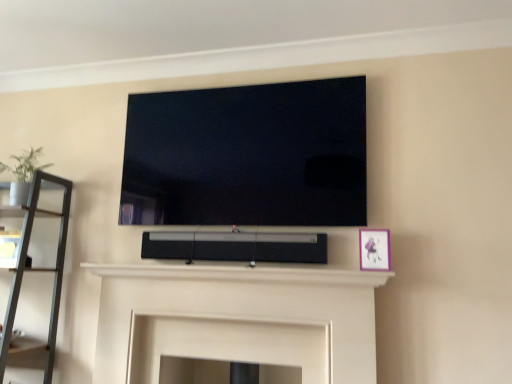
Question: Visually, is black matte speaker at center positioned to the left or to the right of green matte plant at left?

Choices:
 (A) left
 (B) right

Answer: (B)

Question: From their relative heights in the image, would you say black matte speaker at center is taller or shorter than green matte plant at left?

Choices:
 (A) short
 (B) tall

Answer: (A)

Question: Which object is positioned closest to the matte black shelf at left?

Choices:
 (A) flat screen tv at upper center
 (B) white matte fireplace at center
 (C) black matte speaker at center
 (D) green matte plant at left
 (E) matte pink picture frame at right

Answer: (D)

Question: Which of these objects is positioned closest to the black matte speaker at center?

Choices:
 (A) flat screen tv at upper center
 (B) white matte fireplace at center
 (C) matte pink picture frame at right
 (D) green matte plant at left
 (E) matte black shelf at left

Answer: (B)